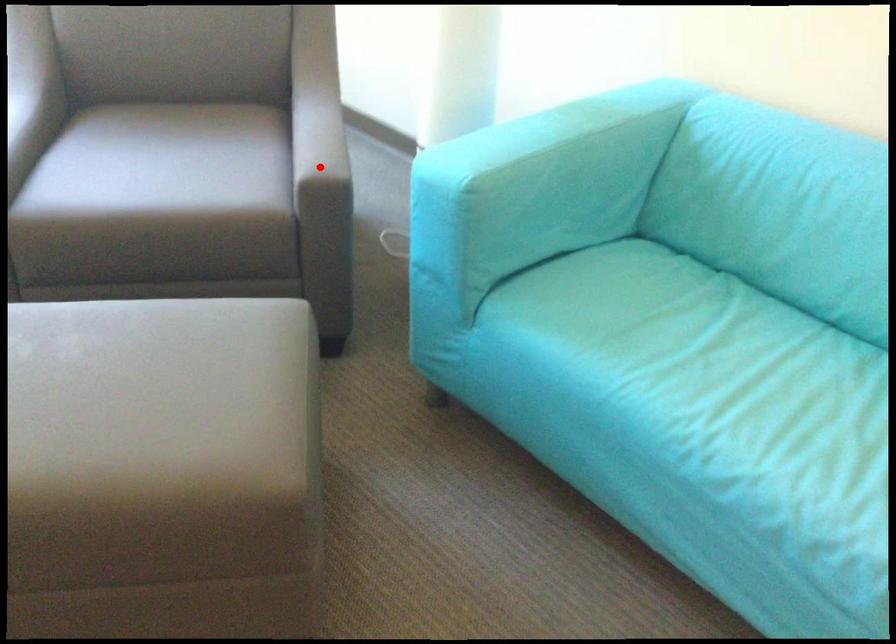
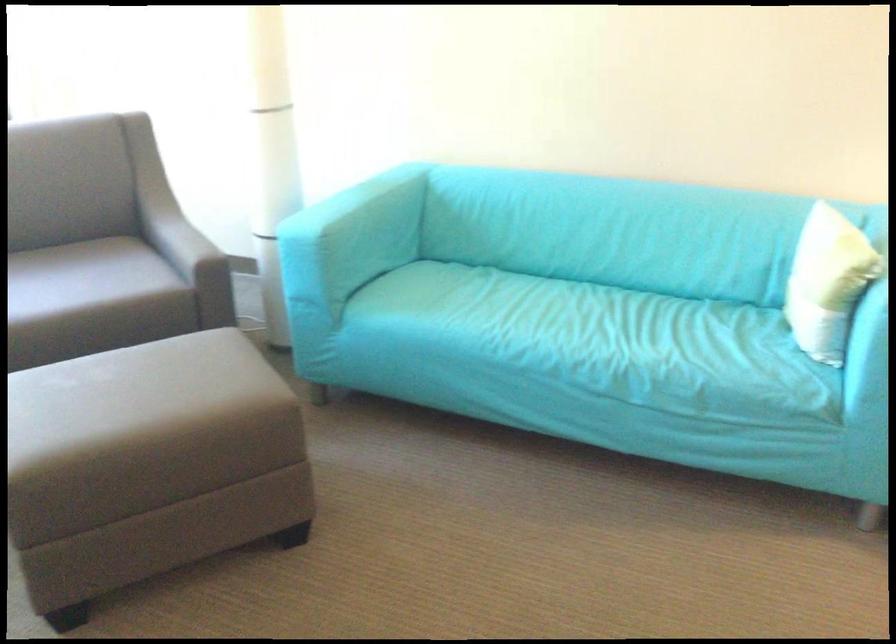
Find the pixel in the second image that matches the highlighted location in the first image.

(188, 251)